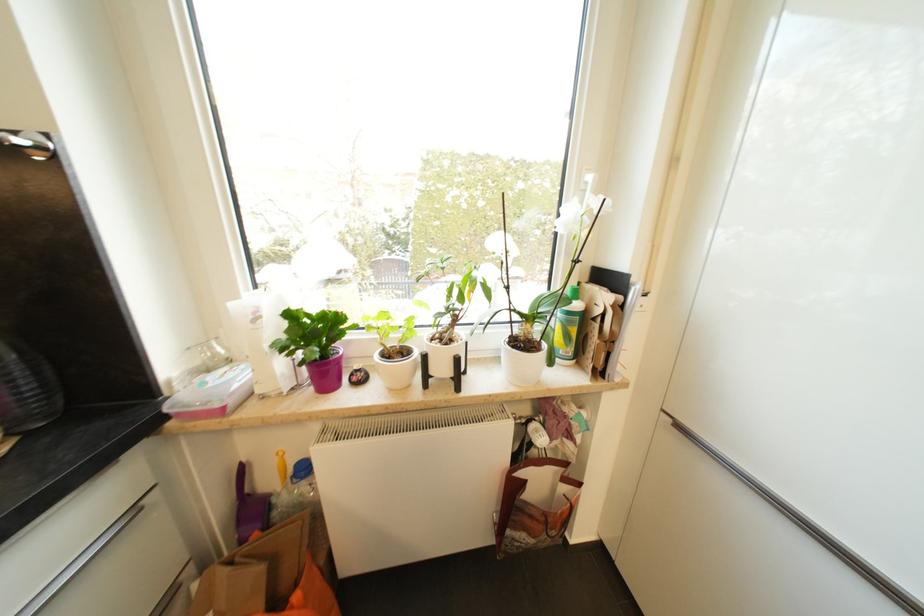
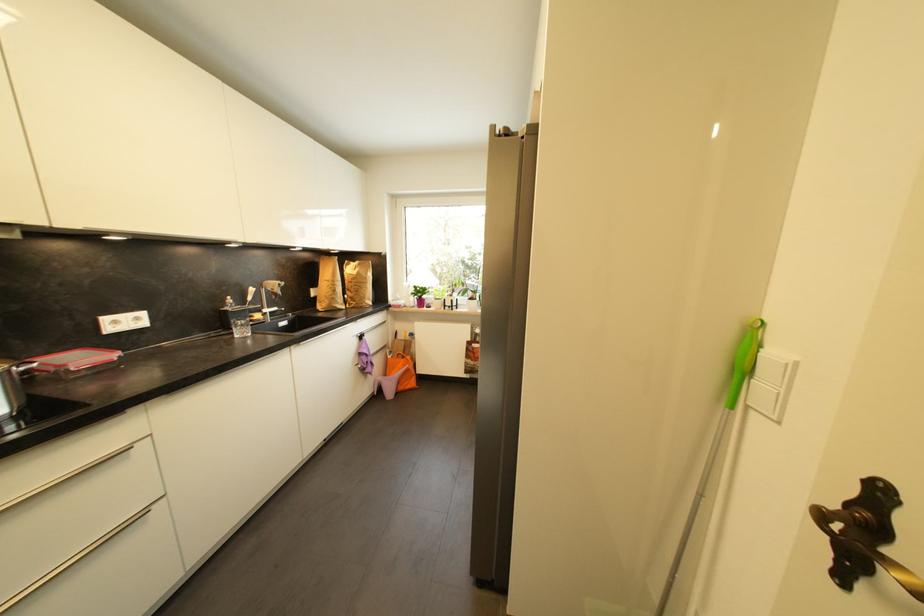
Which direction would the cameraman need to move to produce the second image?

The cameraman walked toward right, backward.